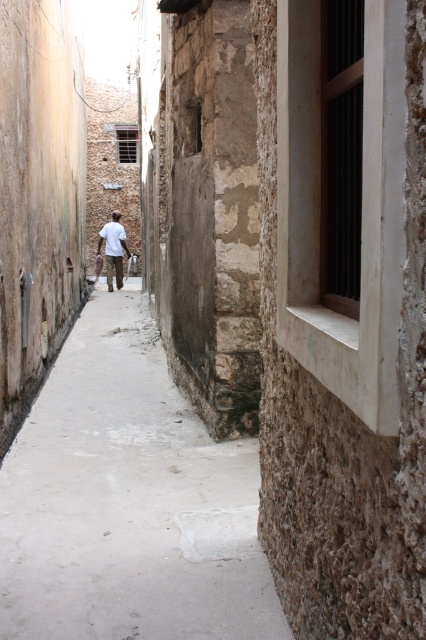
You are standing in the narrow alleyway between the weathered stone walls. You notice a specific point marked at coordinates (127,500). What material is located at that point?

The point at coordinates (127,500) indicates smooth concrete pavement at center.

You are standing at the entrance of the alley and want to walk to the window on the right side. According to the image, where is the smooth concrete pavement at center located?

The smooth concrete pavement at center is located at point [127,500] in 2D coordinates.